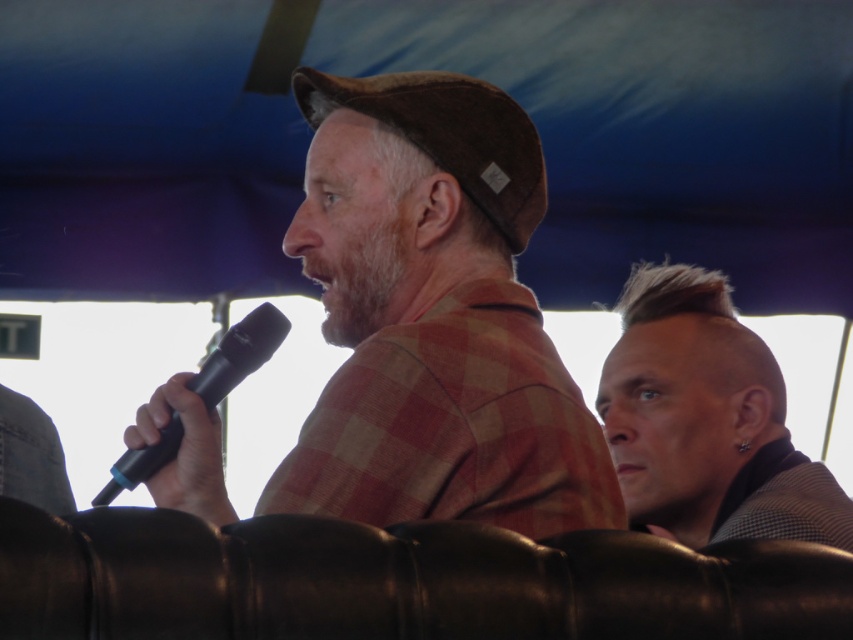
Measure the distance from brown woolen cap at center to black matte microphone at center.

A distance of 19.76 inches exists between brown woolen cap at center and black matte microphone at center.

Is point (408, 76) in front of point (265, 333)?

No, it is behind (265, 333).

Where is `brown woolen cap at center`? brown woolen cap at center is located at coordinates (433, 317).

The width and height of the screenshot is (853, 640). Find the location of `brown woolen cap at center`. brown woolen cap at center is located at coordinates (433, 317).

Can you confirm if brown woolen cap at center is positioned above sleek silver hair at right?

Indeed, brown woolen cap at center is positioned over sleek silver hair at right.

Between point (459, 435) and point (799, 525), which one is positioned behind?

The point (799, 525) is behind.

Measure the distance between point [605,513] and camera.

Point [605,513] and camera are 3.64 meters apart.

Where is `brown woolen cap at center`? The image size is (853, 640). brown woolen cap at center is located at coordinates (433, 317).

Is point (746, 352) closer to camera compared to point (228, 330)?

Yes, point (746, 352) is in front of point (228, 330).

Can you confirm if sleek silver hair at right is bigger than black matte microphone at center?

Correct, sleek silver hair at right is larger in size than black matte microphone at center.

You are a GUI agent. You are given a task and a screenshot of the screen. Output one action in this format:
    pyautogui.click(x=<x>, y=<y>)
    Task: Click on the sleek silver hair at right
    
    Given the screenshot: What is the action you would take?
    pyautogui.click(x=706, y=420)